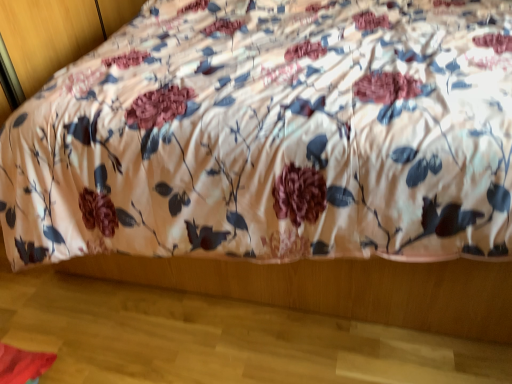
Where is `floral fabric bed at center`? floral fabric bed at center is located at coordinates (272, 136).

Describe the element at coordinates (272, 136) in the screenshot. I see `floral fabric bed at center` at that location.

The height and width of the screenshot is (384, 512). What are the coordinates of `floral fabric bed at center` in the screenshot? It's located at (272, 136).